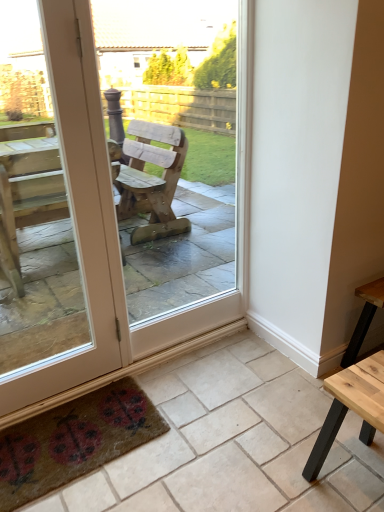
Question: From the image's perspective, does wooden chair at center appear lower than light brown wooden table at lower right?

Choices:
 (A) no
 (B) yes

Answer: (A)

Question: Is wooden chair at center oriented away from light brown wooden table at lower right?

Choices:
 (A) yes
 (B) no

Answer: (B)

Question: Considering the relative sizes of wooden chair at center and light brown wooden table at lower right in the image provided, is wooden chair at center smaller than light brown wooden table at lower right?

Choices:
 (A) yes
 (B) no

Answer: (B)

Question: Can you confirm if wooden chair at center is thinner than light brown wooden table at lower right?

Choices:
 (A) no
 (B) yes

Answer: (B)

Question: From a real-world perspective, does wooden chair at center stand above light brown wooden table at lower right?

Choices:
 (A) yes
 (B) no

Answer: (A)

Question: From the image's perspective, is textured brown mat with ladybugs at lower left above or below brown textured mat at lower left?

Choices:
 (A) below
 (B) above

Answer: (A)

Question: Considering the positions of textured brown mat with ladybugs at lower left and brown textured mat at lower left in the image, is textured brown mat with ladybugs at lower left taller or shorter than brown textured mat at lower left?

Choices:
 (A) tall
 (B) short

Answer: (B)

Question: From a real-world perspective, is textured brown mat with ladybugs at lower left physically located above or below brown textured mat at lower left?

Choices:
 (A) above
 (B) below

Answer: (A)

Question: Considering the positions of point (125, 428) and point (210, 456), is point (125, 428) closer or farther from the camera than point (210, 456)?

Choices:
 (A) farther
 (B) closer

Answer: (A)

Question: Is brown textured mat at lower left spatially inside textured brown mat with ladybugs at lower left, or outside of it?

Choices:
 (A) inside
 (B) outside

Answer: (B)

Question: In the image, is brown textured mat at lower left positioned in front of or behind textured brown mat with ladybugs at lower left?

Choices:
 (A) behind
 (B) front

Answer: (B)

Question: Does point (309, 409) appear closer or farther from the camera than point (67, 441)?

Choices:
 (A) farther
 (B) closer

Answer: (A)

Question: From a real-world perspective, is brown textured mat at lower left physically located above or below textured brown mat with ladybugs at lower left?

Choices:
 (A) above
 (B) below

Answer: (B)

Question: Is textured brown mat with ladybugs at lower left to the left or to the right of light brown wooden table at lower right in the image?

Choices:
 (A) left
 (B) right

Answer: (A)

Question: From a real-world perspective, relative to light brown wooden table at lower right, is textured brown mat with ladybugs at lower left vertically above or below?

Choices:
 (A) above
 (B) below

Answer: (B)